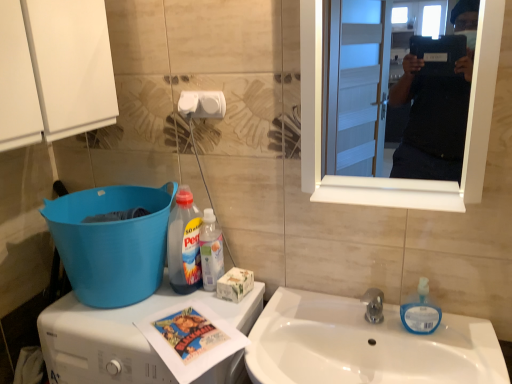
You are a GUI agent. You are given a task and a screenshot of the screen. Output one action in this format:
    pyautogui.click(x=<x>, y=<y>)
    Task: Click on the free location above white plastic washing machine at lower left (from a real-world perspective)
    
    Given the screenshot: What is the action you would take?
    pyautogui.click(x=149, y=312)